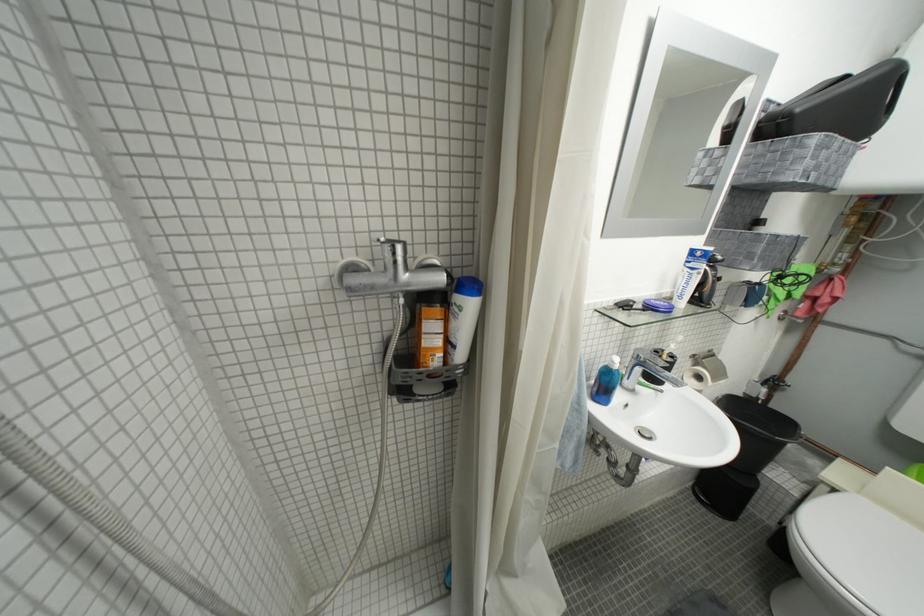
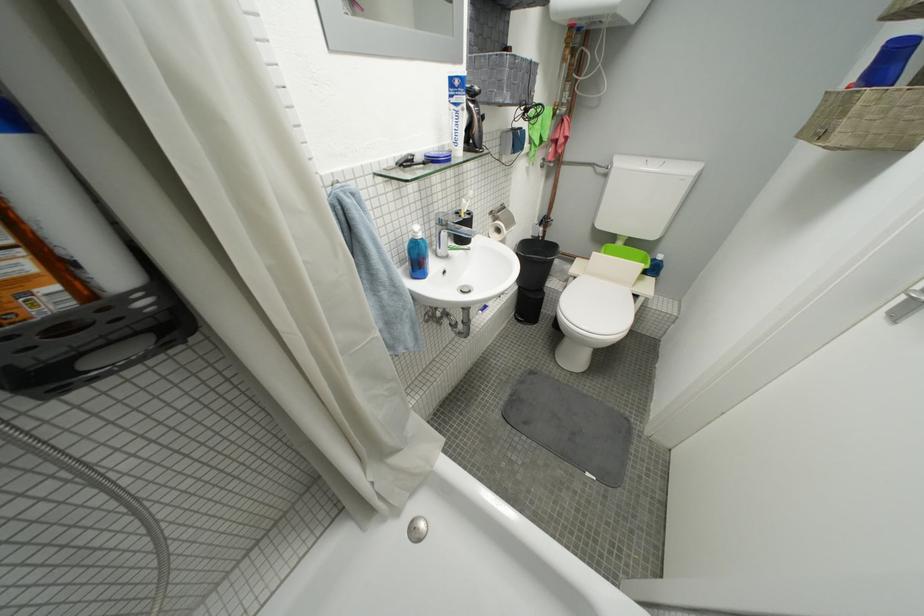
Where in the second image is the point corresponding to point (618, 385) from the first image?

(428, 257)